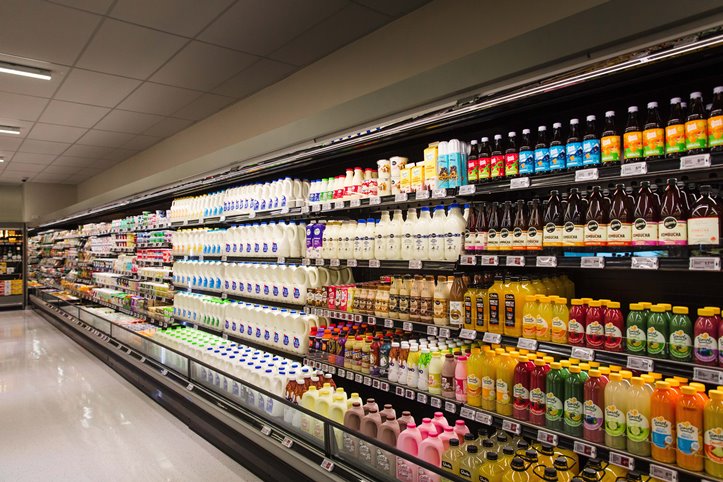
This screenshot has width=723, height=482. Identify the location of tile floor. (84, 427).